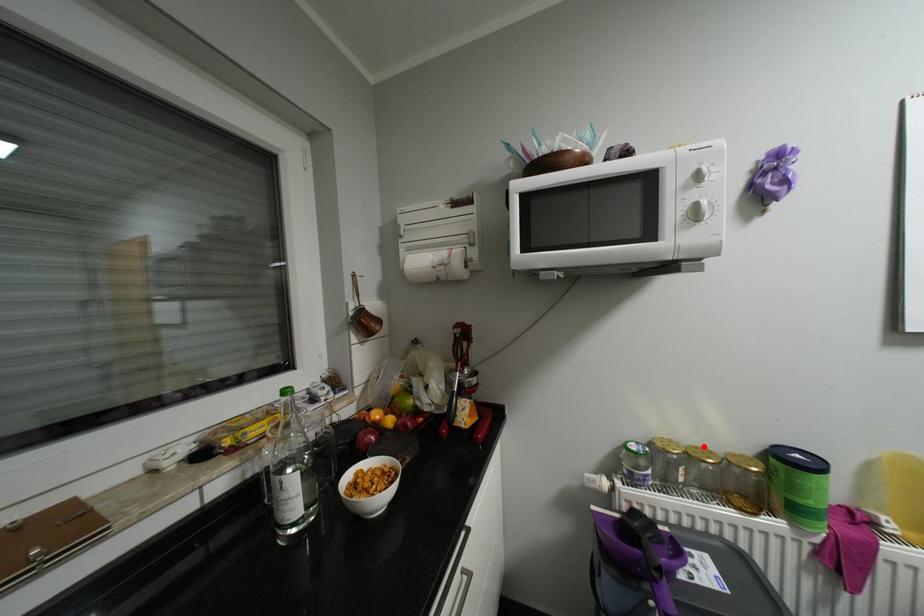
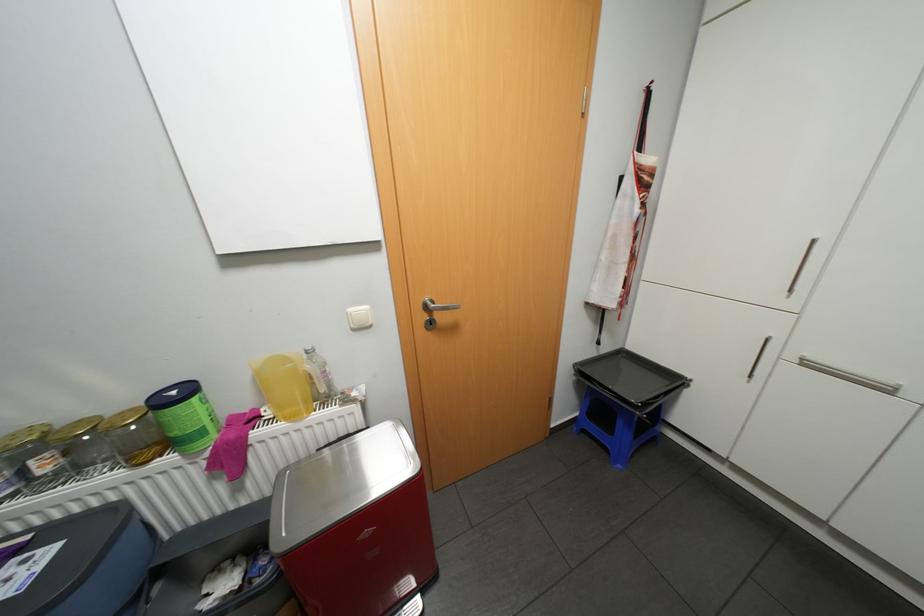
Where in the second image is the point corresponding to the highlighted location from the first image?

(88, 419)